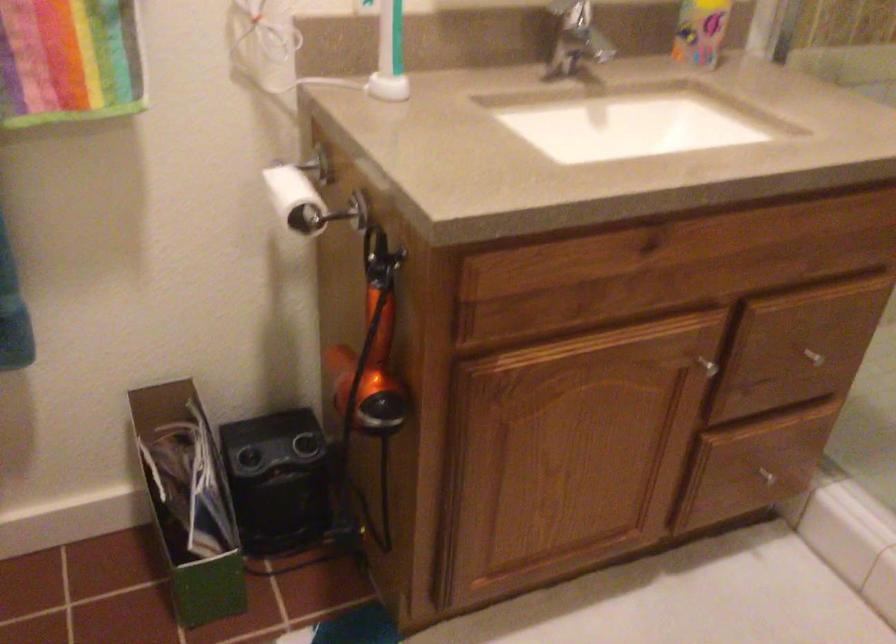
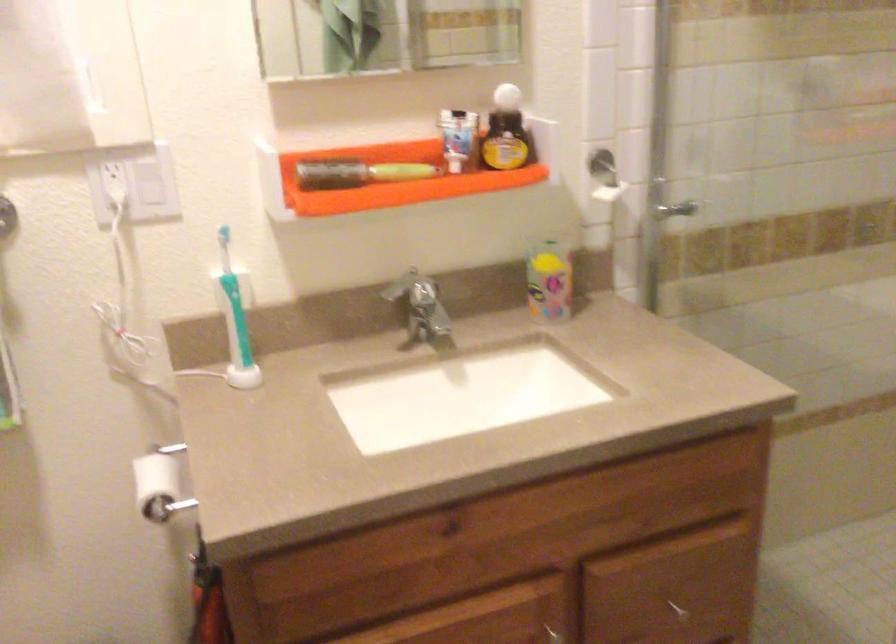
Where in the second image is the point corresponding to point 703,374 from the first image?

(555, 635)